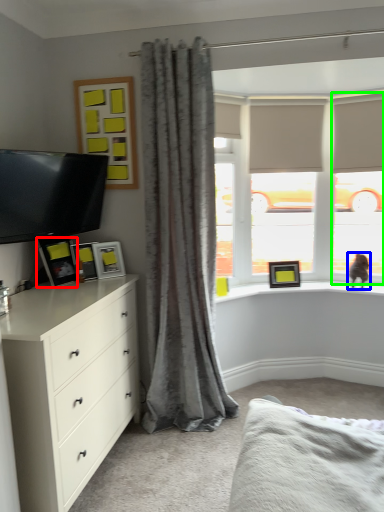
Question: Which is farther away from picture frame (highlighted by a red box)? cat (highlighted by a blue box) or glass door (highlighted by a green box)?

Choices:
 (A) cat
 (B) glass door

Answer: (B)